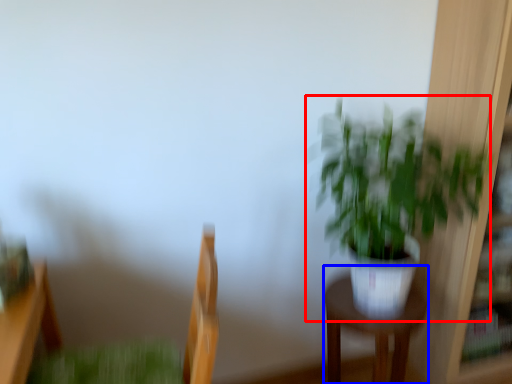
Question: Which point is further to the camera, houseplant (highlighted by a red box) or furniture (highlighted by a blue box)?

Choices:
 (A) houseplant
 (B) furniture

Answer: (B)